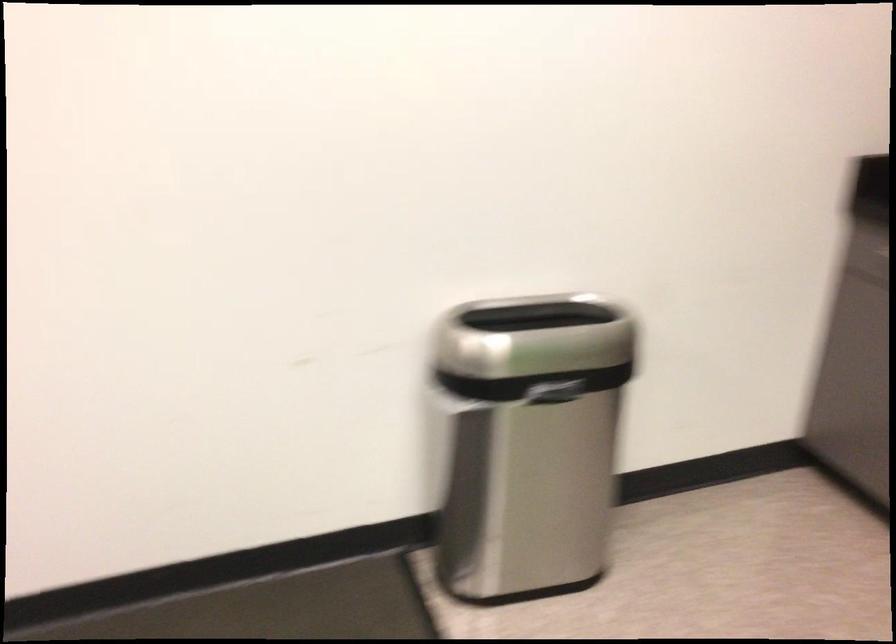
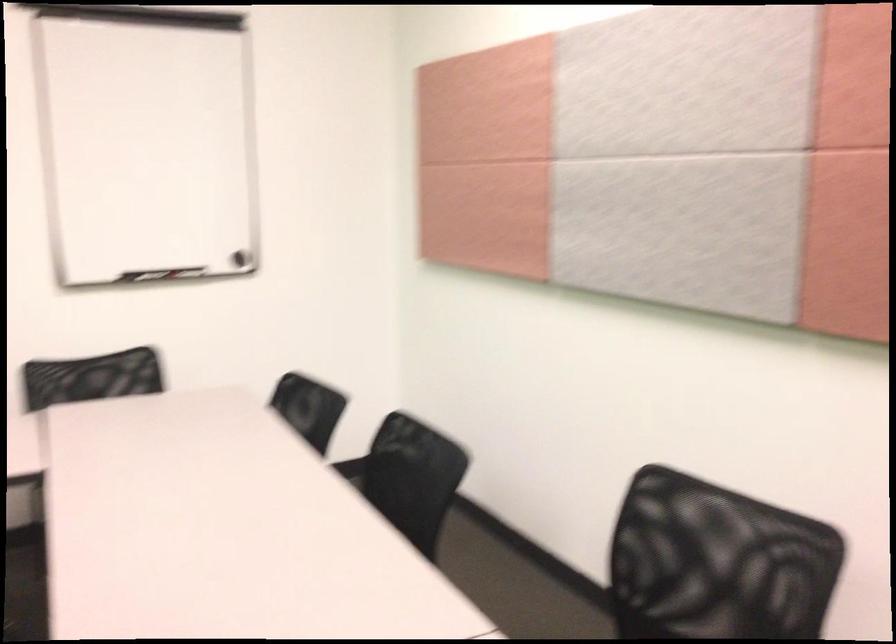
Question: How did the camera likely rotate?

Choices:
 (A) Left
 (B) Right
 (C) Up
 (D) Down

Answer: (A)